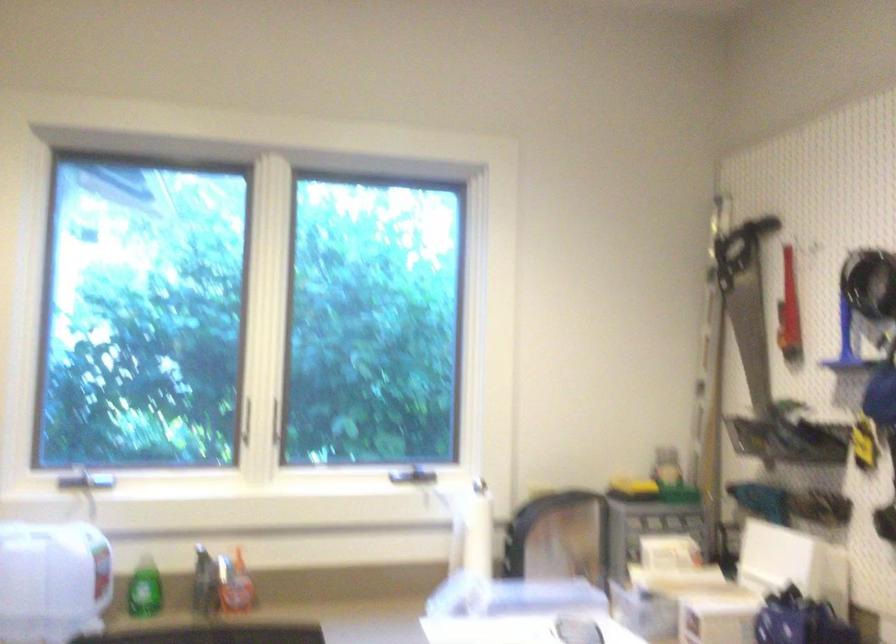
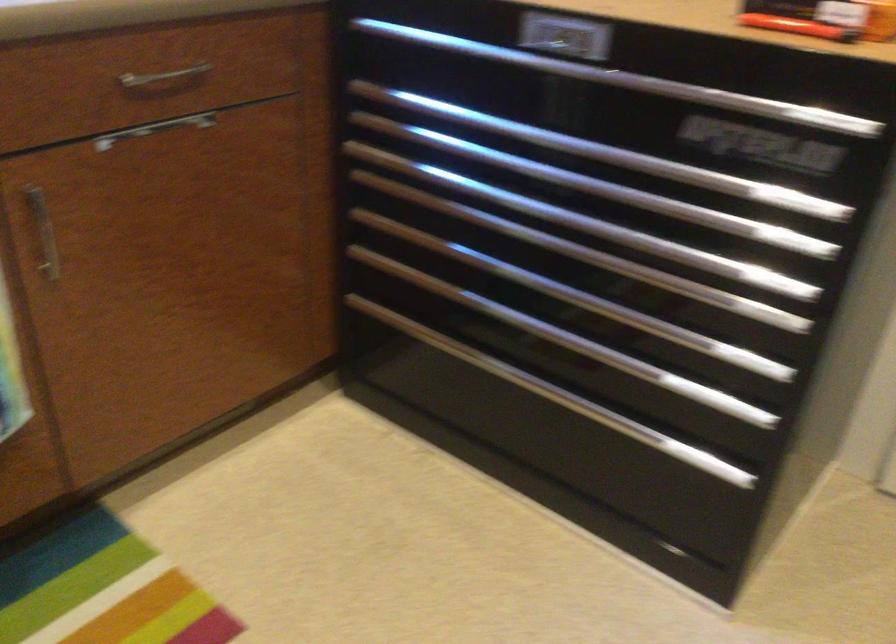
First-person continuous shooting, in which direction is the camera rotating?

The camera's rotation is toward right-down.